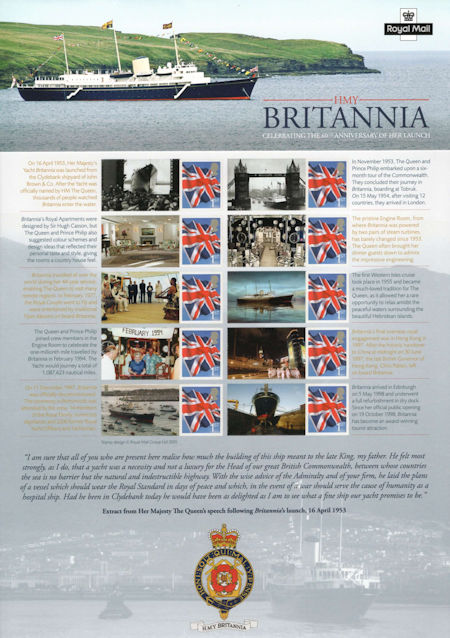
Find the location of `rug`. rug is located at coordinates (146, 258).